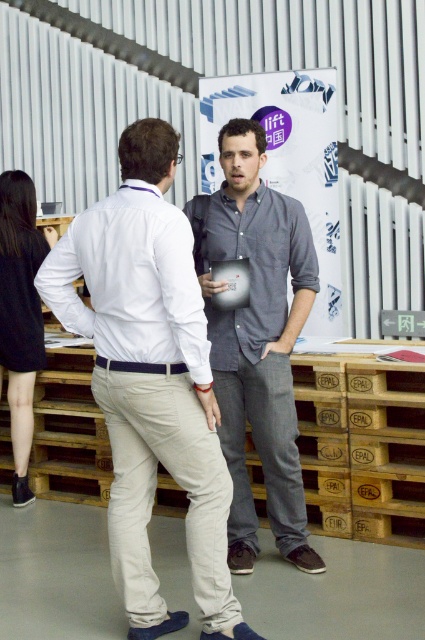
You are a photographer at the event and want to ensure both the gray cotton shirt at center and the white matte shirt at center are visible in your photo. Given their sizes, which shirt should you focus on to include both effectively?

The gray cotton shirt at center is larger in size than the white matte shirt at center, so focusing on the gray cotton shirt at center would help ensure both are visible since it occupies more space and can serve as a focal point while the smaller white matte shirt at center remains in view.